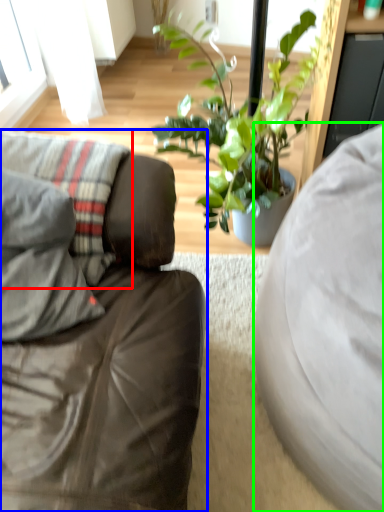
Question: Estimate the real-world distances between objects in this image. Which object is closer to pillow (highlighted by a red box), studio couch (highlighted by a blue box) or studio couch (highlighted by a green box)?

Choices:
 (A) studio couch
 (B) studio couch

Answer: (A)